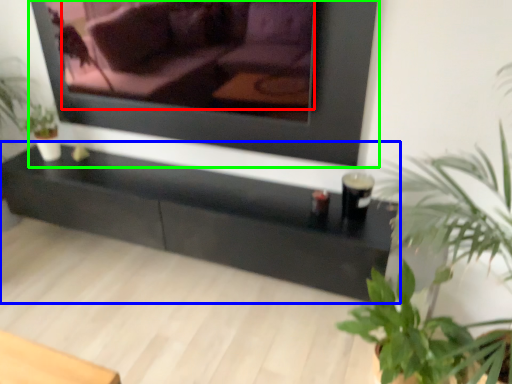
Question: Considering the real-world distances, which object is farthest from couch (highlighted by a red box)? table (highlighted by a blue box) or picture frame (highlighted by a green box)?

Choices:
 (A) table
 (B) picture frame

Answer: (B)